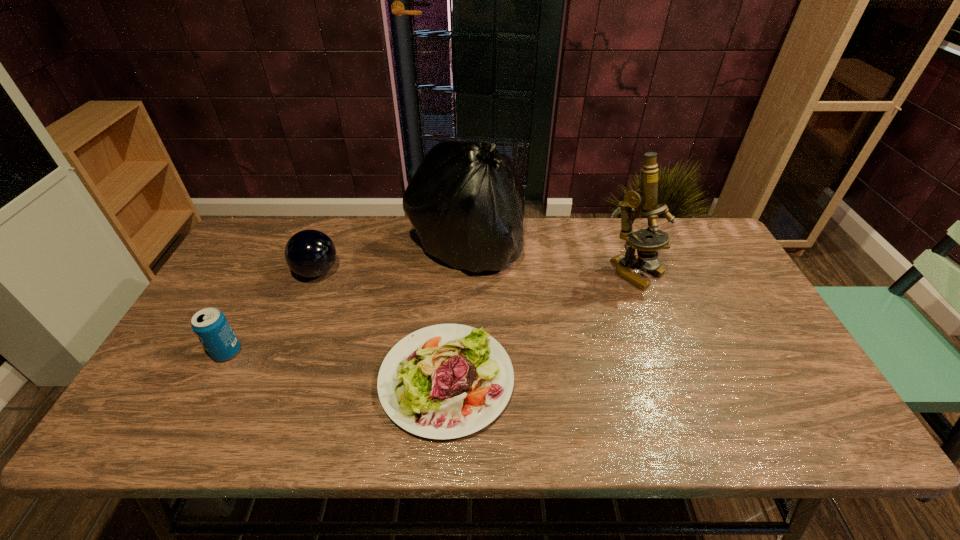
Where is `vacant area between the salad plate and the bowling ball`? Image resolution: width=960 pixels, height=540 pixels. vacant area between the salad plate and the bowling ball is located at coordinates (382, 326).

Locate an element on the screen. The width and height of the screenshot is (960, 540). object that stands as the second closest to the rightmost object is located at coordinates (445, 381).

Identify which object is the second nearest to the plastic bag. Please provide its 2D coordinates. Your answer should be formatted as a tuple, i.e. [(x, y)], where the tuple contains the x and y coordinates of a point satisfying the conditions above.

[(309, 253)]

Identify the location of free spot that satisfies the following two spatial constraints: 1. on the side of the salad plate with the finger holes; 2. on the left side of the second object from left to right. The height and width of the screenshot is (540, 960). (274, 380).

The width and height of the screenshot is (960, 540). What are the coordinates of `free space in the image that satisfies the following two spatial constraints: 1. on the back side of the microscope; 2. on the side of the fourth object from right to left with the finger holes` in the screenshot? It's located at (636, 272).

Find the location of `free location that satisfies the following two spatial constraints: 1. on the side of the fourth object from right to left with the finger holes; 2. on the left side of the shortest object`. free location that satisfies the following two spatial constraints: 1. on the side of the fourth object from right to left with the finger holes; 2. on the left side of the shortest object is located at coordinates (274, 380).

Where is `blank area in the image that satisfies the following two spatial constraints: 1. on the back side of the microscope; 2. on the right side of the leftmost object`? Image resolution: width=960 pixels, height=540 pixels. blank area in the image that satisfies the following two spatial constraints: 1. on the back side of the microscope; 2. on the right side of the leftmost object is located at coordinates (269, 272).

Where is `vacant space that satisfies the following two spatial constraints: 1. on the side of the fourth object from right to left with the finger holes; 2. on the back side of the rightmost object`? vacant space that satisfies the following two spatial constraints: 1. on the side of the fourth object from right to left with the finger holes; 2. on the back side of the rightmost object is located at coordinates (317, 272).